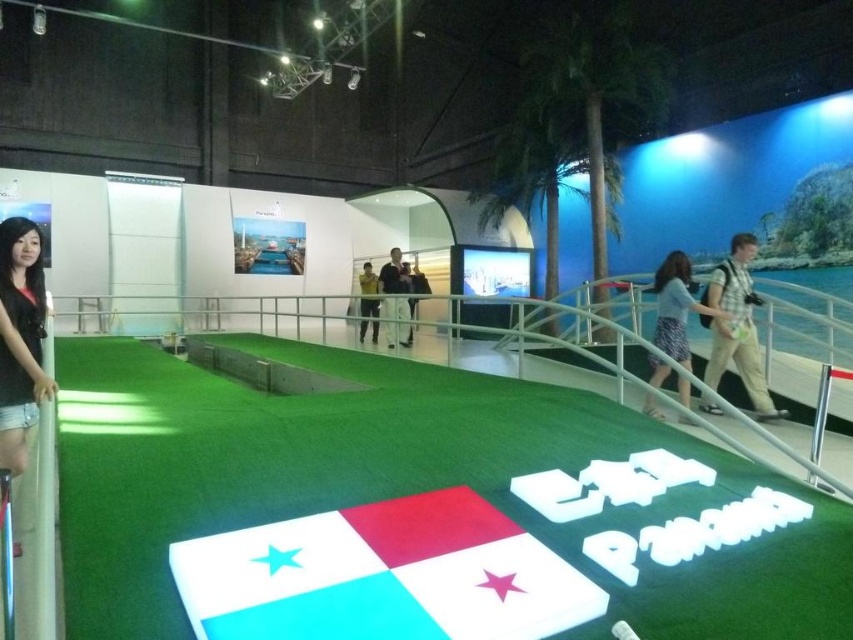
Who is shorter, light brown fabric pants at center or yellow fabric jacket at center?

With less height is yellow fabric jacket at center.

Is light brown fabric pants at center positioned at the back of yellow fabric jacket at center?

No, it is not.

Does point (404, 342) lie behind point (375, 321)?

That is False.

At what (x,y) coordinates should I click in order to perform the action: click on light brown fabric pants at center. Please return your answer as a coordinate pair (x, y). The height and width of the screenshot is (640, 853). Looking at the image, I should click on (396, 321).

Which of these two, plaid shirt at right or light brown fabric pants at center, stands shorter?

plaid shirt at right is shorter.

Is plaid shirt at right closer to the viewer compared to light brown fabric pants at center?

Yes, it is.

Is point (763, 396) positioned behind point (387, 296)?

No.

You are a GUI agent. You are given a task and a screenshot of the screen. Output one action in this format:
    pyautogui.click(x=<x>, y=<y>)
    Task: Click on the plaid shirt at right
    
    Given the screenshot: What is the action you would take?
    pyautogui.click(x=737, y=326)

Is black denim shorts at lower left positioned in front of plaid shirt at right?

Yes, it is in front of plaid shirt at right.

Does black denim shorts at lower left have a lesser height compared to plaid shirt at right?

Yes, black denim shorts at lower left is shorter than plaid shirt at right.

Is point (9, 282) in front of point (753, 372)?

That is True.

Where is `black denim shorts at lower left`? black denim shorts at lower left is located at coordinates (20, 339).